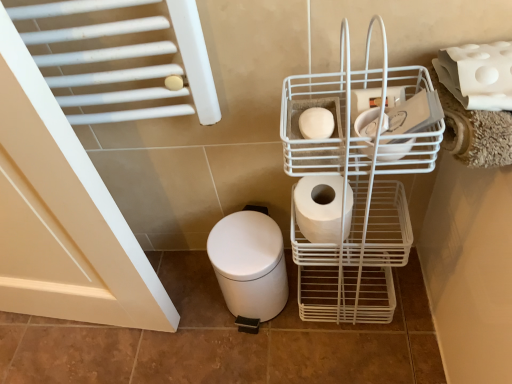
In order to click on free space above white matte toilet bowl at lower left (from a real-world perspective) in this screenshot , I will do `click(244, 248)`.